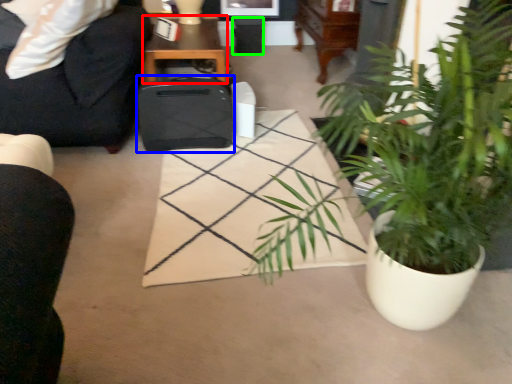
Question: Based on their relative distances, which object is farther from table (highlighted by a red box)? Choose from luggage (highlighted by a blue box) and trash bin/can (highlighted by a green box).

Choices:
 (A) luggage
 (B) trash bin/can

Answer: (B)